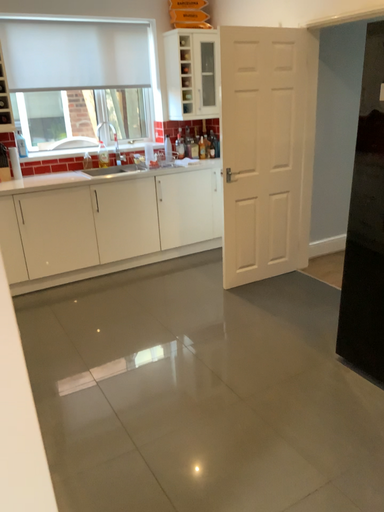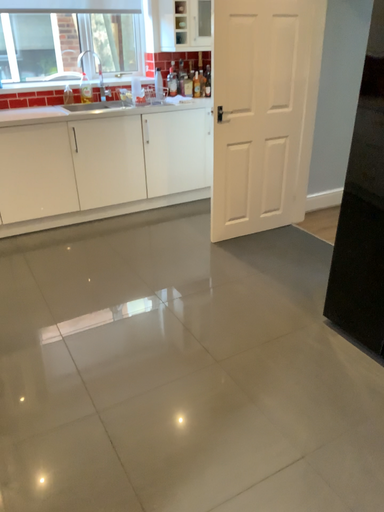
Question: Which way did the camera rotate in the video?

Choices:
 (A) rotated upward
 (B) rotated downward

Answer: (B)